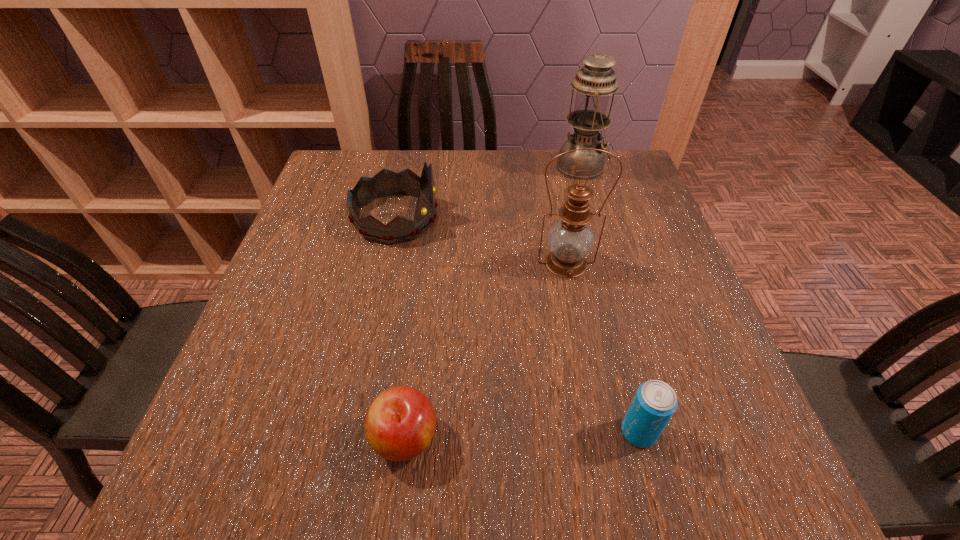
The image size is (960, 540). I want to click on vacant space located 0.140m on the back of the apple, so click(x=417, y=339).

Find the location of a particular element. oil lamp situated at the far edge is located at coordinates (594, 82).

Image resolution: width=960 pixels, height=540 pixels. I want to click on tiara present at the far edge, so click(x=385, y=183).

The image size is (960, 540). In order to click on soda can located at the near edge in this screenshot , I will do `click(655, 402)`.

The width and height of the screenshot is (960, 540). In order to click on apple at the near edge in this screenshot , I will do `click(400, 423)`.

Identify the location of object at the left edge. The height and width of the screenshot is (540, 960). (385, 183).

The height and width of the screenshot is (540, 960). Identify the location of oil lamp that is at the right edge. (594, 82).

The image size is (960, 540). Identify the location of soda can that is positioned at the right edge. (655, 402).

Where is `object situated at the far left corner`? object situated at the far left corner is located at coordinates (385, 183).

Where is `object present at the far right corner`? The image size is (960, 540). object present at the far right corner is located at coordinates (594, 82).